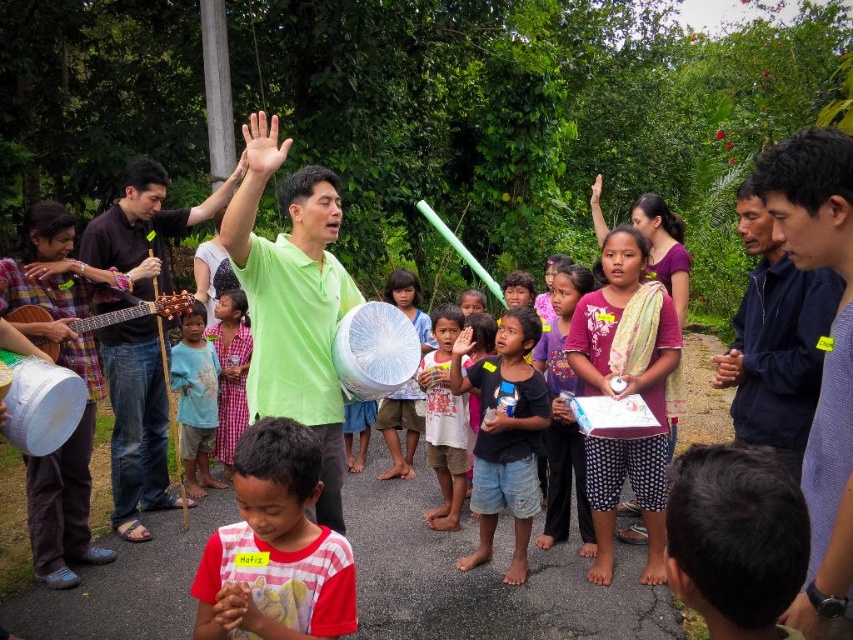
How far apart are green matte shirt at center and matte plastic plate at center?

The distance of green matte shirt at center from matte plastic plate at center is 2.33 meters.

Can you confirm if green matte shirt at center is positioned below matte plastic plate at center?

Incorrect, green matte shirt at center is not positioned below matte plastic plate at center.

Who is more distant from viewer, (253, 323) or (405, 291)?

Positioned behind is point (405, 291).

The image size is (853, 640). Find the location of `green matte shirt at center`. green matte shirt at center is located at coordinates (293, 301).

Is point (318, 484) closer to viewer compared to point (233, 307)?

Yes, point (318, 484) is in front of point (233, 307).

Can you confirm if striped cotton shirt at lower left is bigger than blue plaid shirt at center?

Incorrect, striped cotton shirt at lower left is not larger than blue plaid shirt at center.

You are a GUI agent. You are given a task and a screenshot of the screen. Output one action in this format:
    pyautogui.click(x=<x>, y=<y>)
    Task: Click on the striped cotton shirt at lower left
    
    Given the screenshot: What is the action you would take?
    pyautogui.click(x=276, y=548)

Which is above, brown hair at lower right or matte wooden guitar at left?

Positioned higher is matte wooden guitar at left.

How far apart are brown hair at lower right and matte wooden guitar at left?

brown hair at lower right is 11.41 feet away from matte wooden guitar at left.

Does point (738, 531) come in front of point (38, 310)?

Yes, point (738, 531) is closer to viewer.

What are the coordinates of `brown hair at lower right` in the screenshot? It's located at (735, 540).